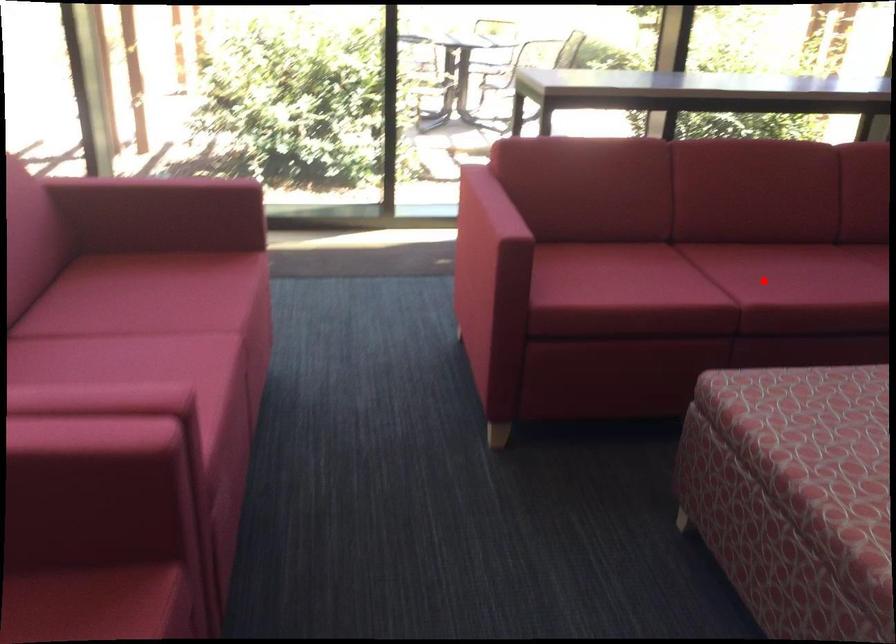
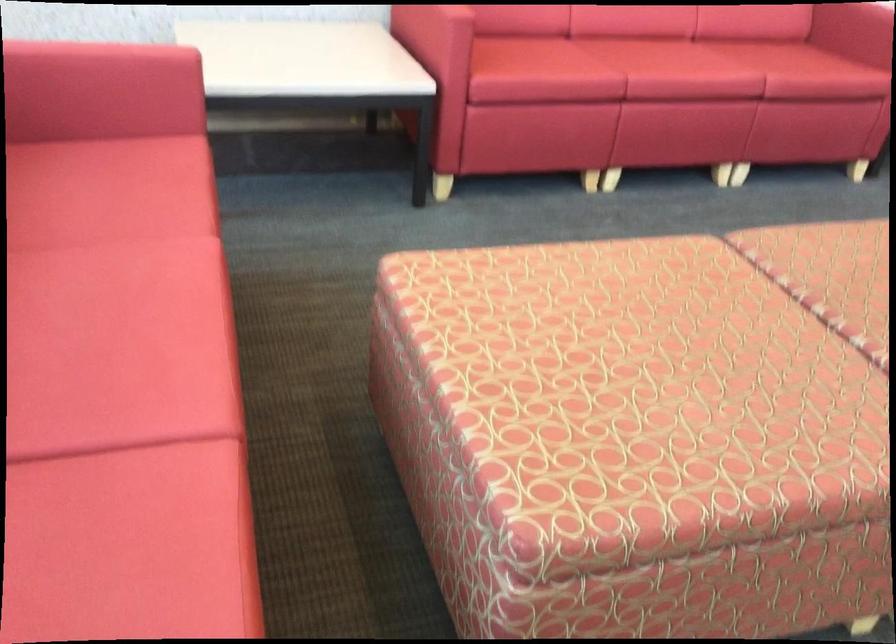
Question: I am providing you with two images of the same scene from different viewpoints. In image1, a red point is highlighted. Considering the same 3D point in image2, which of the following is correct?

Choices:
 (A) It is closer
 (B) It is farther

Answer: (A)